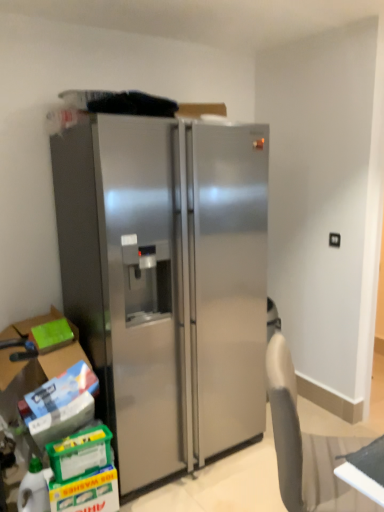
Question: Is point (178, 216) closer or farther from the camera than point (43, 493)?

Choices:
 (A) closer
 (B) farther

Answer: (B)

Question: From their relative heights in the image, would you say stainless steel refrigerator at center is taller or shorter than translucent plastic bottle at lower left?

Choices:
 (A) short
 (B) tall

Answer: (B)

Question: Estimate the real-world distances between objects in this image. Which object is closer to the green matte box at lower left?

Choices:
 (A) stainless steel refrigerator at center
 (B) translucent plastic bottle at lower left

Answer: (B)

Question: Estimate the real-world distances between objects in this image. Which object is closer to the stainless steel refrigerator at center?

Choices:
 (A) translucent plastic bottle at lower left
 (B) green matte box at lower left

Answer: (B)